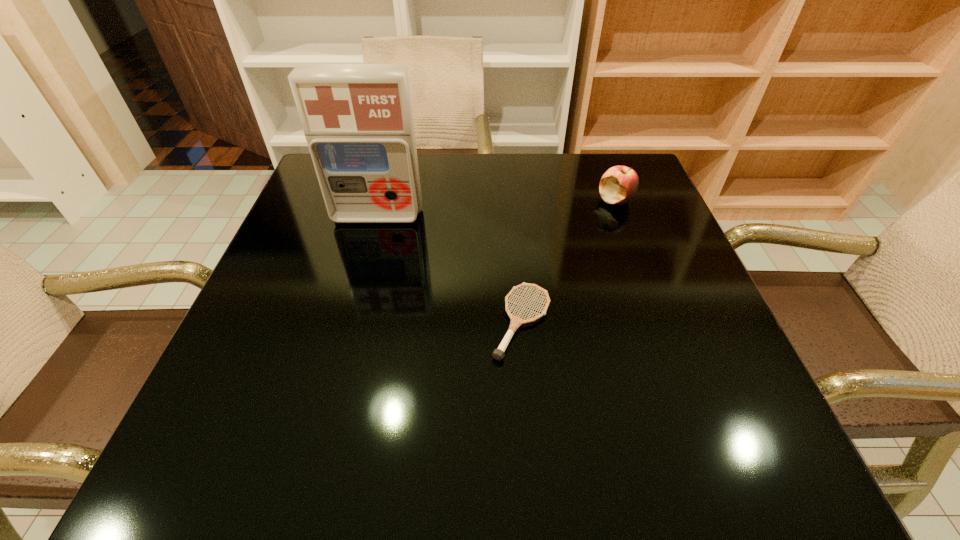
The image size is (960, 540). In order to click on object that is at the left edge in this screenshot , I will do `click(357, 119)`.

Image resolution: width=960 pixels, height=540 pixels. Find the location of `object positioned at the right edge`. object positioned at the right edge is located at coordinates (x=618, y=185).

You are a GUI agent. You are given a task and a screenshot of the screen. Output one action in this format:
    pyautogui.click(x=<x>, y=<y>)
    Task: Click on the object situated at the far right corner
    The image size is (960, 540).
    Given the screenshot: What is the action you would take?
    pyautogui.click(x=618, y=185)

You are a GUI agent. You are given a task and a screenshot of the screen. Output one action in this format:
    pyautogui.click(x=<x>, y=<y>)
    Task: Click on the free space at the far edge
    This screenshot has width=960, height=540.
    Given the screenshot: What is the action you would take?
    pyautogui.click(x=555, y=188)

This screenshot has height=540, width=960. I want to click on vacant space at the near edge, so click(475, 464).

Where is `free location at the left edge of the desktop`? free location at the left edge of the desktop is located at coordinates (250, 422).

Where is `vacant space at the right edge`? The image size is (960, 540). vacant space at the right edge is located at coordinates (656, 287).

The height and width of the screenshot is (540, 960). In the image, there is a desktop. What are the coordinates of `vacant region at the near left corner` in the screenshot? It's located at (264, 453).

This screenshot has height=540, width=960. In order to click on vacant region at the far right corner of the desktop in this screenshot , I will do `click(585, 163)`.

The height and width of the screenshot is (540, 960). In the image, there is a desktop. Find the location of `vacant space at the near right corner`. vacant space at the near right corner is located at coordinates point(713,447).